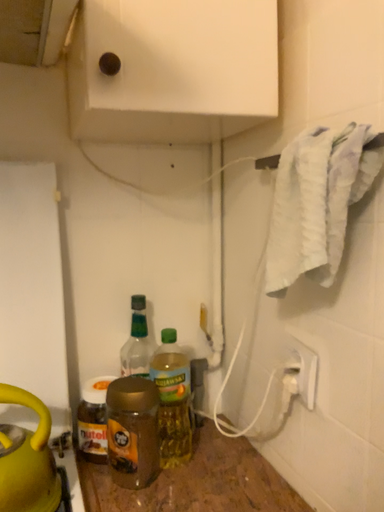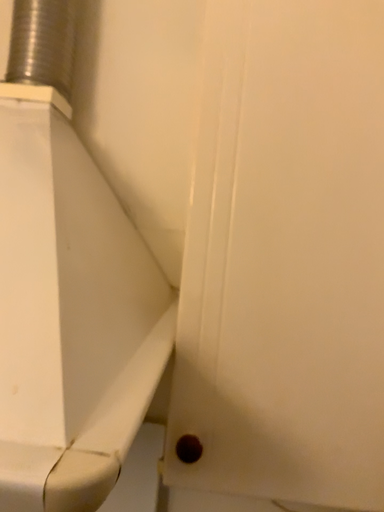
Question: How did the camera likely rotate when shooting the video?

Choices:
 (A) rotated downward
 (B) rotated upward

Answer: (B)